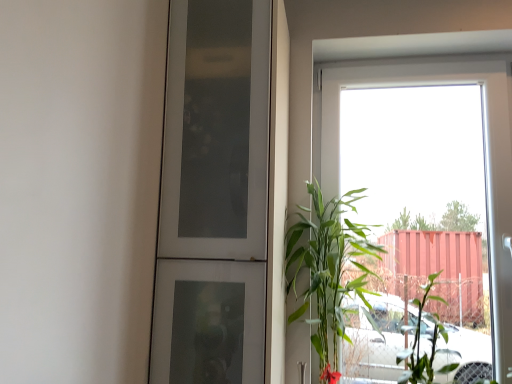
I want to click on green leafy plant at right, so click(420, 337).

Image resolution: width=512 pixels, height=384 pixels. I want to click on transparent glass window at upper right, so click(x=484, y=135).

This screenshot has height=384, width=512. What do you see at coordinates (328, 270) in the screenshot?
I see `green leafy plant at right` at bounding box center [328, 270].

I want to click on white frosted glass door at center, so click(x=213, y=195).

Does point (415, 303) come farther from viewer compared to point (256, 300)?

Yes, point (415, 303) is behind point (256, 300).

Does green leafy plant at right turn towards white frosted glass door at center?

No, green leafy plant at right is not facing towards white frosted glass door at center.

Is green leafy plant at right shorter than white frosted glass door at center?

Yes.

Which is correct: green leafy plant at right is inside white frosted glass door at center, or outside of it?

green leafy plant at right is outside white frosted glass door at center.

How many degrees apart are the facing directions of transparent glass window at upper right and green leafy plant at right?

The angle between the facing direction of transparent glass window at upper right and the facing direction of green leafy plant at right is 0.441 degrees.

Between transparent glass window at upper right and green leafy plant at right, which one has smaller width?

transparent glass window at upper right.

Does transparent glass window at upper right come behind green leafy plant at right?

Yes, transparent glass window at upper right is behind green leafy plant at right.

Can you confirm if transparent glass window at upper right is smaller than green leafy plant at right?

Actually, transparent glass window at upper right might be larger than green leafy plant at right.

Is white frosted glass door at center located outside green leafy plant at right?

Yes, white frosted glass door at center is outside of green leafy plant at right.

Considering the relative positions of white frosted glass door at center and green leafy plant at right in the image provided, is white frosted glass door at center to the right of green leafy plant at right from the viewer's perspective?

No, white frosted glass door at center is not to the right of green leafy plant at right.

Where is `houseplant that appears behind the white frosted glass door at center`? houseplant that appears behind the white frosted glass door at center is located at coordinates (328, 270).

From the image's perspective, does white frosted glass door at center appear lower than green leafy plant at right?

No, from the image's perspective, white frosted glass door at center is not below green leafy plant at right.

Is green leafy plant at right positioned beyond the bounds of green leafy plant at right?

That's correct, green leafy plant at right is outside of green leafy plant at right.

Does green leafy plant at right have a greater width compared to green leafy plant at right?

No, green leafy plant at right is not wider than green leafy plant at right.

How distant is green leafy plant at right from green leafy plant at right?

green leafy plant at right and green leafy plant at right are 13.55 inches apart from each other.

In the scene shown: Who is taller, green leafy plant at right or green leafy plant at right?

With more height is green leafy plant at right.

Considering the sizes of objects green leafy plant at right and green leafy plant at right in the image provided, who is thinner, green leafy plant at right or green leafy plant at right?

green leafy plant at right is thinner.

Between green leafy plant at right and green leafy plant at right, which one appears on the left side from the viewer's perspective?

green leafy plant at right.

The width and height of the screenshot is (512, 384). What are the coordinates of `houseplant above the green leafy plant at right (from a real-world perspective)` in the screenshot? It's located at click(x=328, y=270).

Considering the positions of objects green leafy plant at right and transparent glass window at upper right in the image provided, who is in front, green leafy plant at right or transparent glass window at upper right?

green leafy plant at right.

In order to click on houseplant in front of the transparent glass window at upper right in this screenshot , I will do `click(328, 270)`.

Is green leafy plant at right facing towards transparent glass window at upper right?

No, green leafy plant at right does not turn towards transparent glass window at upper right.

Between white frosted glass door at center and transparent glass window at upper right, which one appears on the right side from the viewer's perspective?

transparent glass window at upper right is more to the right.

Is white frosted glass door at center inside or outside of transparent glass window at upper right?

white frosted glass door at center exists outside the volume of transparent glass window at upper right.

Measure the distance from white frosted glass door at center to transparent glass window at upper right.

A distance of 29.29 inches exists between white frosted glass door at center and transparent glass window at upper right.

Which point is more distant from viewer, (234,56) or (509,320)?

The point (509,320) is farther from the camera.

You are a GUI agent. You are given a task and a screenshot of the screen. Output one action in this format:
    pyautogui.click(x=<x>, y=<y>)
    Task: Click on the plant that is on the right side of white frosted glass door at center
    The width and height of the screenshot is (512, 384).
    Given the screenshot: What is the action you would take?
    pyautogui.click(x=420, y=337)

In order to click on plant below the transparent glass window at upper right (from the image's perspective) in this screenshot , I will do `click(420, 337)`.

Based on their spatial positions, is white frosted glass door at center or transparent glass window at upper right further from green leafy plant at right?

white frosted glass door at center.

Estimate the real-world distances between objects in this image. Which object is further from transparent glass window at upper right, white frosted glass door at center or green leafy plant at right?

white frosted glass door at center is positioned further to the anchor transparent glass window at upper right.

Estimate the real-world distances between objects in this image. Which object is closer to white frosted glass door at center, transparent glass window at upper right or green leafy plant at right?

green leafy plant at right is positioned closer to the anchor white frosted glass door at center.

When comparing their distances from white frosted glass door at center, does green leafy plant at right or green leafy plant at right seem closer?

The object closer to white frosted glass door at center is green leafy plant at right.

Looking at this image, considering their positions, is green leafy plant at right positioned further to white frosted glass door at center than transparent glass window at upper right?

Among the two, green leafy plant at right is located further to white frosted glass door at center.

Which object lies further to the anchor point white frosted glass door at center, green leafy plant at right or transparent glass window at upper right?

transparent glass window at upper right.

When comparing their distances from green leafy plant at right, does transparent glass window at upper right or green leafy plant at right seem closer?

green leafy plant at right lies closer to green leafy plant at right than the other object.

Considering their positions, is green leafy plant at right positioned further to transparent glass window at upper right than green leafy plant at right?

The object further to transparent glass window at upper right is green leafy plant at right.

The height and width of the screenshot is (384, 512). I want to click on houseplant between white frosted glass door at center and green leafy plant at right, so click(328, 270).

The width and height of the screenshot is (512, 384). In order to click on houseplant located between white frosted glass door at center and transparent glass window at upper right in the left-right direction in this screenshot , I will do `click(328, 270)`.

At what (x,y) coordinates should I click in order to perform the action: click on houseplant between transparent glass window at upper right and green leafy plant at right in the up-down direction. Please return your answer as a coordinate pair (x, y). The height and width of the screenshot is (384, 512). Looking at the image, I should click on (328, 270).

In order to click on plant between white frosted glass door at center and transparent glass window at upper right in the horizontal direction in this screenshot , I will do `click(420, 337)`.